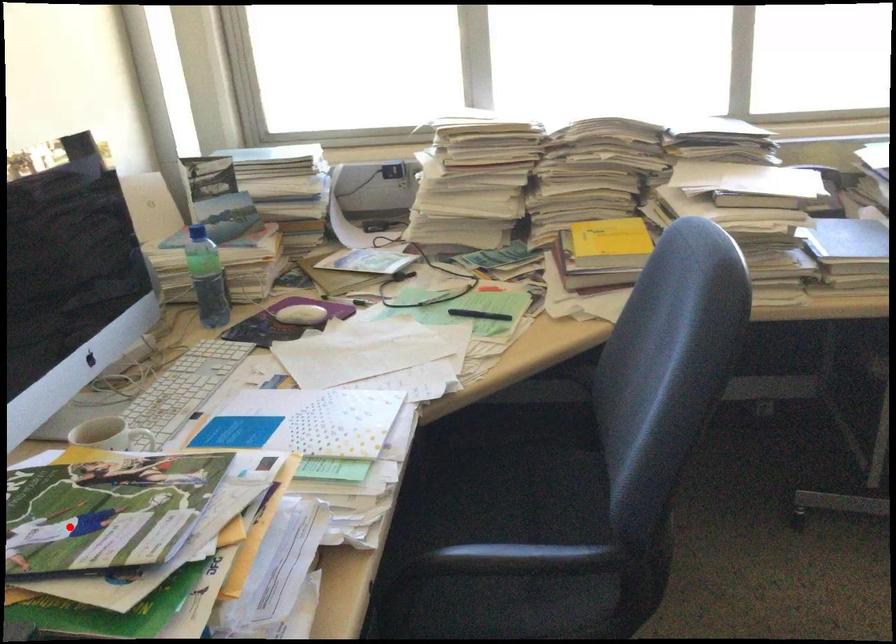
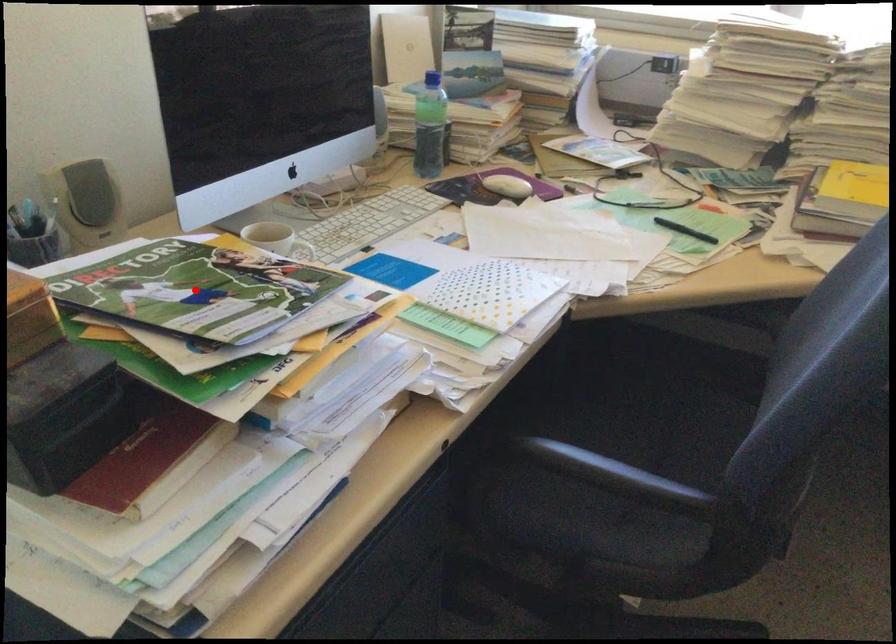
I am providing you with two images of the same scene from different viewpoints. A red point is marked on the first image and another point is marked on the second image. Are the points marked in image1 and image2 representing the same 3D position?

Yes